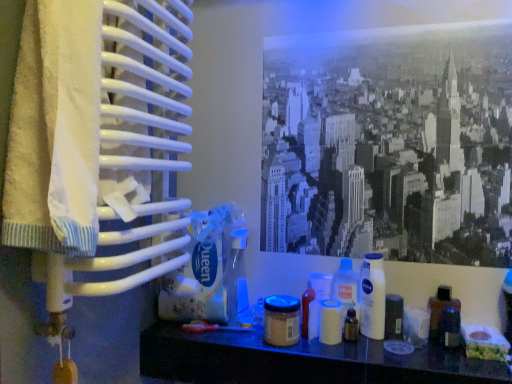
Question: Is white plastic jar at center, the 3th toiletry when ordered from right to left, wider than white plastic container at center, the fourth toiletry viewed from the left?

Choices:
 (A) yes
 (B) no

Answer: (A)

Question: Is white plastic jar at center, the 3th toiletry when ordered from right to left, not close to white plastic container at center, positioned as the 4th toiletry in right-to-left order?

Choices:
 (A) yes
 (B) no

Answer: (B)

Question: Does white plastic jar at center, the 5th toiletry when ordered from left to right, lie in front of white plastic container at center, the fourth toiletry viewed from the left?

Choices:
 (A) yes
 (B) no

Answer: (A)

Question: From the image's perspective, is white plastic jar at center, the 5th toiletry when ordered from left to right, over white plastic container at center, the fourth toiletry viewed from the left?

Choices:
 (A) no
 (B) yes

Answer: (A)

Question: Is white plastic jar at center, the 5th toiletry when ordered from left to right, behind white plastic container at center, the fourth toiletry viewed from the left?

Choices:
 (A) no
 (B) yes

Answer: (A)

Question: Is white plastic container at center, the fourth toiletry viewed from the left, a part of white plastic jar at center, the 3th toiletry when ordered from right to left?

Choices:
 (A) yes
 (B) no

Answer: (B)

Question: Is translucent plastic bottle at center shorter than matte black container at lower right, placed as the 7th toiletry when sorted from left to right?

Choices:
 (A) yes
 (B) no

Answer: (B)

Question: Would you consider translucent plastic bottle at center to be distant from matte black container at lower right, placed as the 7th toiletry when sorted from left to right?

Choices:
 (A) yes
 (B) no

Answer: (B)

Question: Is translucent plastic bottle at center next to matte black container at lower right, arranged as the 1th toiletry when viewed from the right?

Choices:
 (A) no
 (B) yes

Answer: (A)

Question: Does translucent plastic bottle at center contain matte black container at lower right, placed as the 7th toiletry when sorted from left to right?

Choices:
 (A) no
 (B) yes

Answer: (A)

Question: From a real-world perspective, is translucent plastic bottle at center physically below matte black container at lower right, arranged as the 1th toiletry when viewed from the right?

Choices:
 (A) yes
 (B) no

Answer: (B)

Question: Can you confirm if translucent plastic bottle at center is positioned to the right of matte black container at lower right, arranged as the 1th toiletry when viewed from the right?

Choices:
 (A) yes
 (B) no

Answer: (B)

Question: Is white plastic container at center, the fourth toiletry viewed from the left, positioned behind monochrome cityscape at upper center?

Choices:
 (A) no
 (B) yes

Answer: (B)